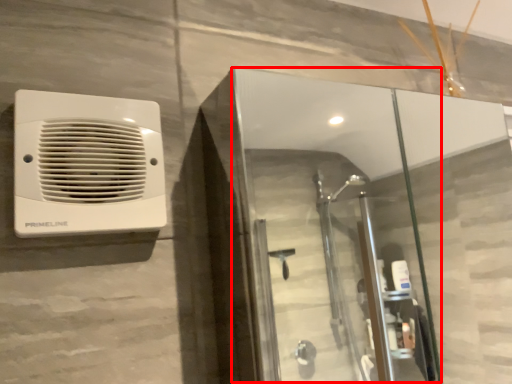
Question: Where is screen door (annotated by the red box) located in relation to home appliance in the image?

Choices:
 (A) right
 (B) left

Answer: (A)